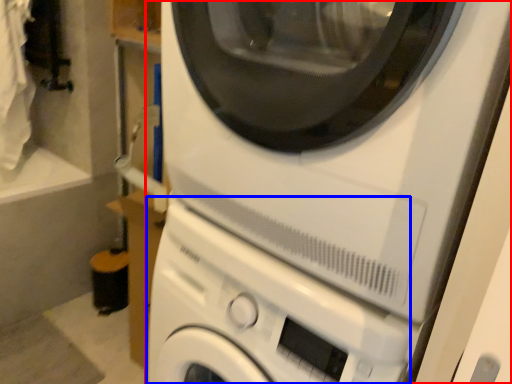
Question: Among these objects, which one is nearest to the camera, washing machine (highlighted by a red box) or washing machine (highlighted by a blue box)?

Choices:
 (A) washing machine
 (B) washing machine

Answer: (A)